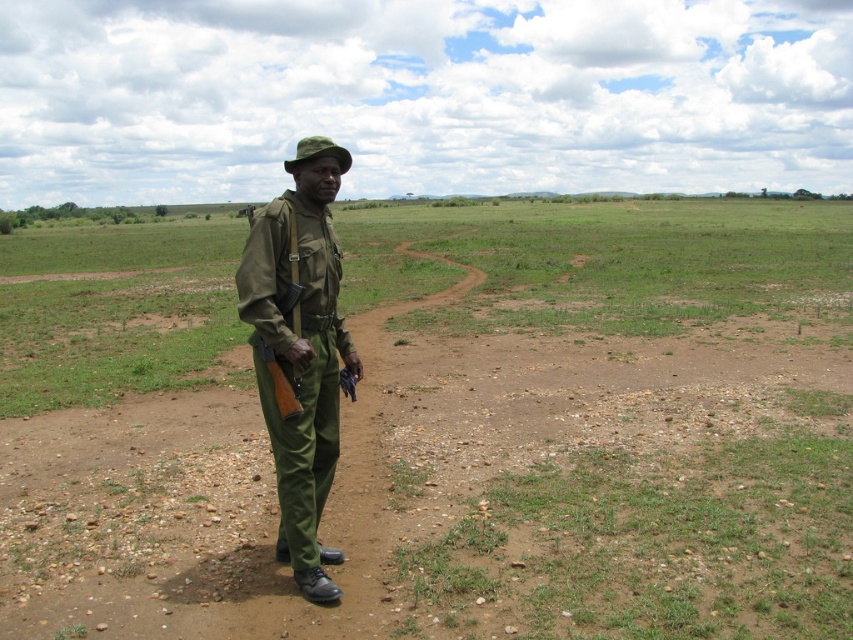
Who is higher up, green uniform at center or matte green uniform at center?

green uniform at center

Who is taller, green uniform at center or matte green uniform at center?

green uniform at center

Is point (440, 481) more distant than point (311, 490)?

Yes, it is.

Find the location of a particular element. This screenshot has height=640, width=853. green uniform at center is located at coordinates (445, 428).